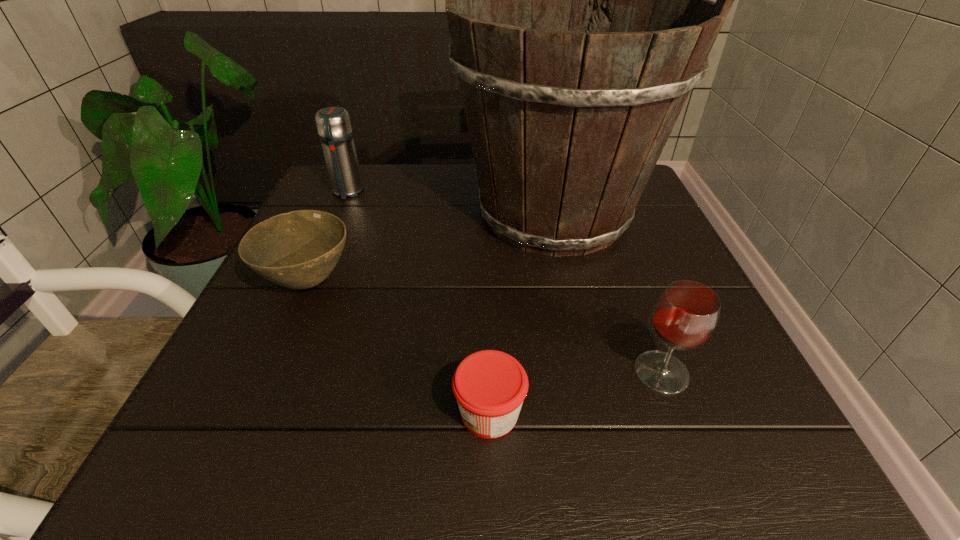
Identify the location of bucket. (567, 118).

You are a GUI agent. You are given a task and a screenshot of the screen. Output one action in this format:
    pyautogui.click(x=<x>, y=<y>)
    Task: Click on the second tallest object
    
    Given the screenshot: What is the action you would take?
    pyautogui.click(x=335, y=132)

Identify the location of wineglass. (685, 316).

The height and width of the screenshot is (540, 960). I want to click on the fourth tallest object, so pyautogui.click(x=299, y=249).

Locate an element on the screen. jam is located at coordinates (490, 386).

You are a GUI agent. You are given a task and a screenshot of the screen. Output one action in this format:
    pyautogui.click(x=<x>, y=<y>)
    Task: Click on the vacant region located 0.320m on the left of the tallest object
    This screenshot has height=540, width=960.
    Given the screenshot: What is the action you would take?
    pos(311,214)

Where is `free space located with a handle on the side of the fourth shortest object`? The width and height of the screenshot is (960, 540). free space located with a handle on the side of the fourth shortest object is located at coordinates (295, 310).

What are the coordinates of `vacant space located 0.110m on the back of the third shortest object` in the screenshot? It's located at (636, 303).

What are the coordinates of `free space located 0.360m on the back of the fourth tallest object` in the screenshot? It's located at (357, 171).

Find the location of a particular element. The image size is (960, 540). free spot located on the label side of the shortest object is located at coordinates (243, 413).